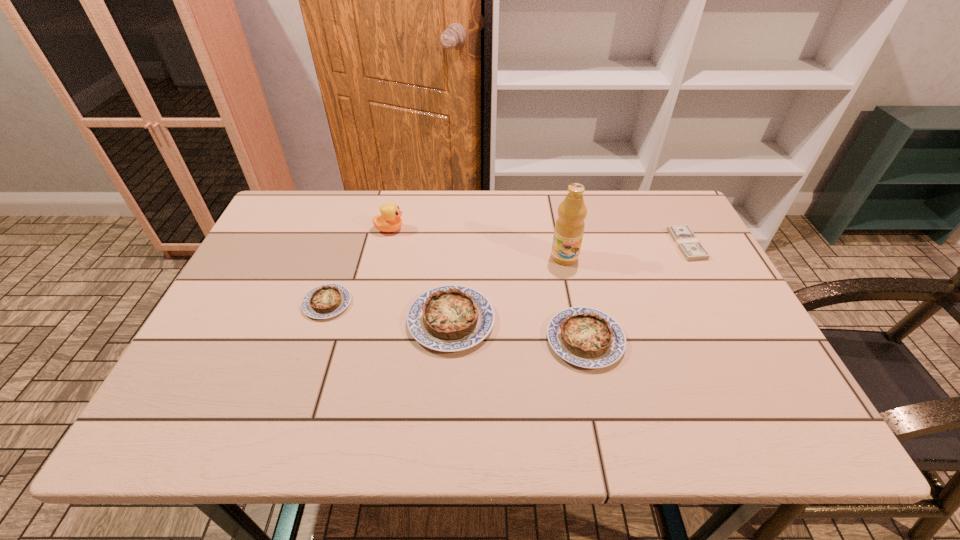
Locate an element on the screen. The height and width of the screenshot is (540, 960). vacant point located 0.080m on the back of the leftmost object is located at coordinates (340, 266).

At what (x,y) coordinates should I click in order to perform the action: click on blank space located on the back of the fourth object from right to left. Please return your answer as a coordinate pair (x, y). This screenshot has width=960, height=540. Looking at the image, I should click on click(458, 204).

This screenshot has height=540, width=960. In order to click on vacant point located on the right of the rightmost quiche in this screenshot , I will do `click(671, 340)`.

What are the coordinates of `vacant region located on the label of the olive oil` in the screenshot? It's located at (580, 329).

Identify the location of vacant point located on the left of the rightmost object. The image size is (960, 540). (560, 244).

Image resolution: width=960 pixels, height=540 pixels. In order to click on vacant area situated on the face of the duckling in this screenshot , I will do `click(462, 229)`.

The image size is (960, 540). Identify the location of dollar present at the far edge. (691, 248).

This screenshot has height=540, width=960. Identify the location of duckling located in the far edge section of the desktop. (389, 221).

Locate an element on the screen. The image size is (960, 540). object at the near edge is located at coordinates (586, 337).

You are a GUI agent. You are given a task and a screenshot of the screen. Output one action in this format:
    pyautogui.click(x=<x>, y=<y>)
    Task: Click on the object that is at the right edge
    The height and width of the screenshot is (540, 960).
    Given the screenshot: What is the action you would take?
    pyautogui.click(x=691, y=248)